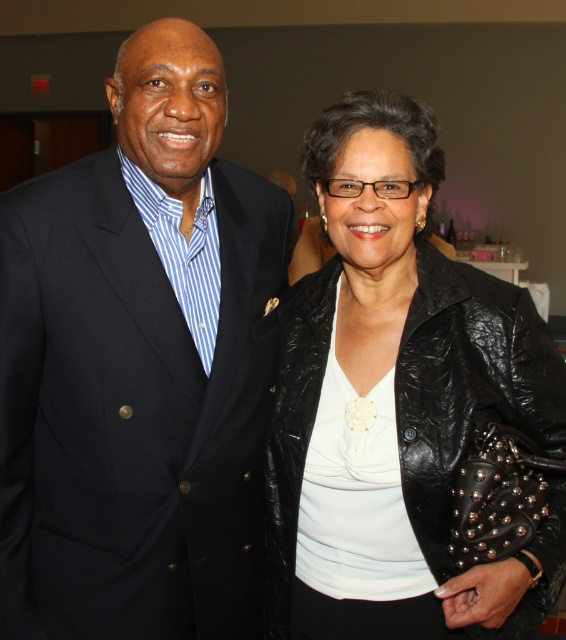
You are at a formal event and need to identify clothing items based on their positions. Which clothing item is higher up between the matte black suit at left and the black leather jacket at right?

The matte black suit at left is higher up compared to the black leather jacket at right.

You are a photographer at a formal event and need to adjust the camera focus. The matte black suit at left and the black leather jacket at right are both in the frame. Which one is closer to the camera?

The matte black suit at left is closer to the camera because it is only 9.01 inches away from the black leather jacket at right, indicating proximity.

You are at a formal event and need to find the matte black suit at left and the black leather jacket at right. Which one is positioned to the left side of the other?

The matte black suit at left is positioned to the left of the black leather jacket at right.